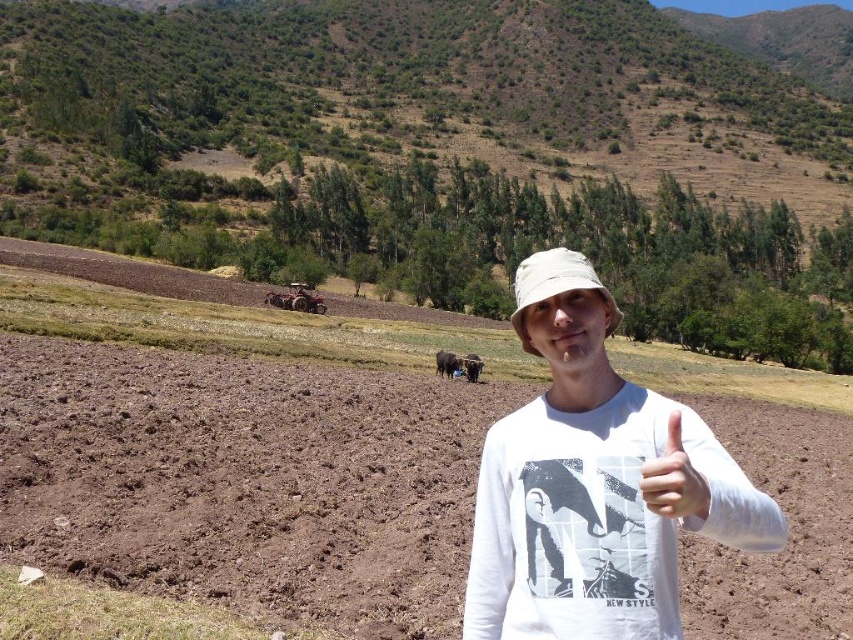
From the picture: You are a drone operator trying to capture a photo of the white cotton shirt at center and the white matte hand at center. The camera has a maximum focus range of 2 meters. Will you be able to capture both objects in focus at the same time?

The white cotton shirt at center is 2.42 meters from the white matte hand at center. Since the maximum focus range is 2 meters, the distance between them exceeds the camera limit. Therefore, both objects cannot be in focus simultaneously.

In the scene shown: You are a photographer trying to capture the scene. You notice the white cotton shirt at center and the white matte hand at center. Which object should you focus on first if you want to ensure both are in sharp focus?

The white cotton shirt at center is further to the viewer than the white matte hand at center. To ensure both are in sharp focus, focus on the white cotton shirt at center first since it is closer, and the depth of field will likely include the hand behind it.